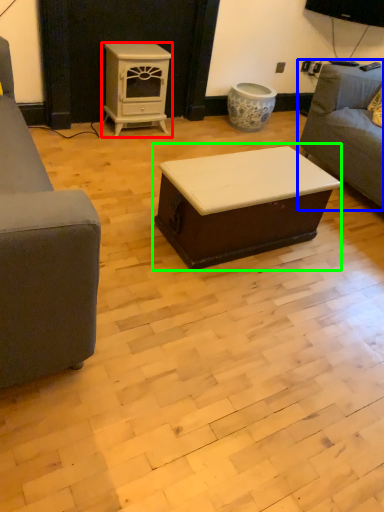
Question: Which object is positioned closest to appliance (highlighted by a red box)? Select from studio couch (highlighted by a blue box) and table (highlighted by a green box).

Choices:
 (A) studio couch
 (B) table

Answer: (A)